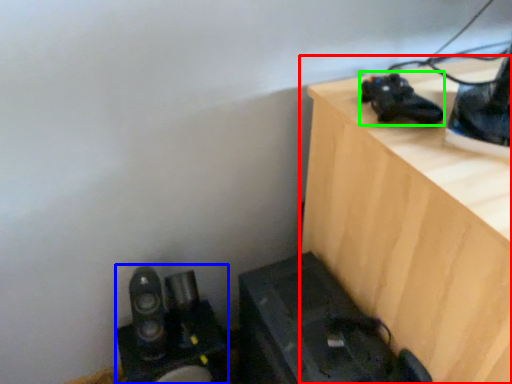
Question: Which object is the closest to the furniture (highlighted by a red box)? Choose among these: equipment (highlighted by a blue box) or shoe (highlighted by a green box).

Choices:
 (A) equipment
 (B) shoe

Answer: (B)